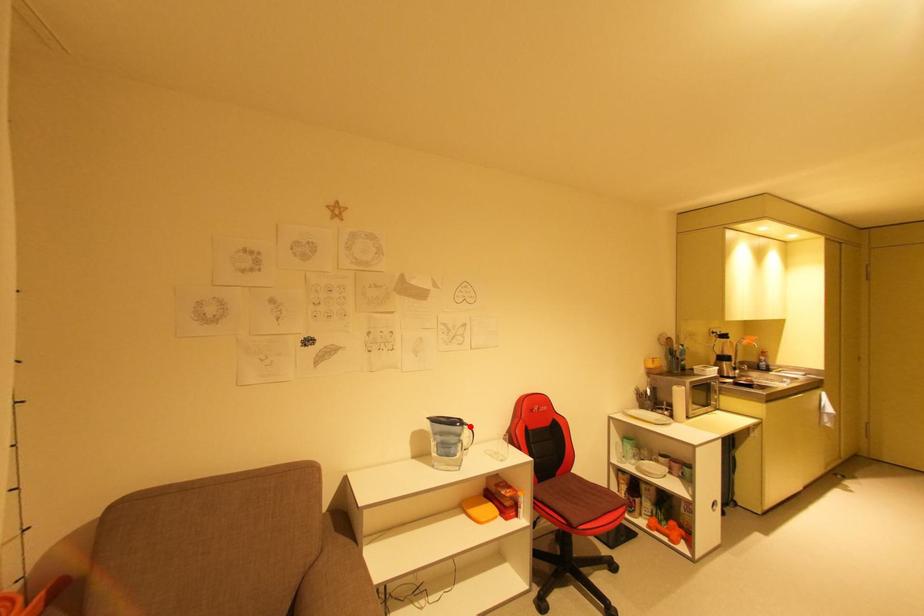
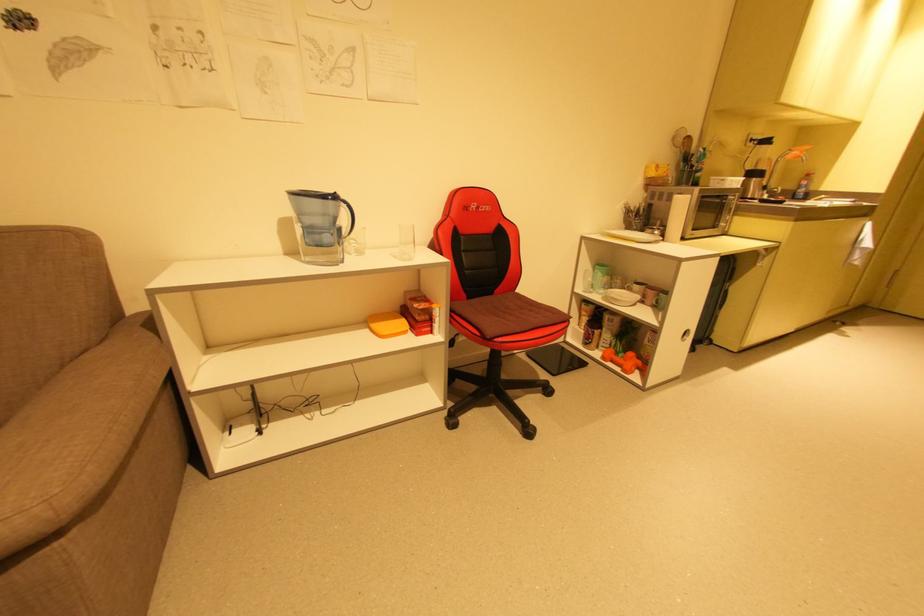
Locate, in the second image, the point that corresponds to the highlighted location in the first image.

(346, 204)